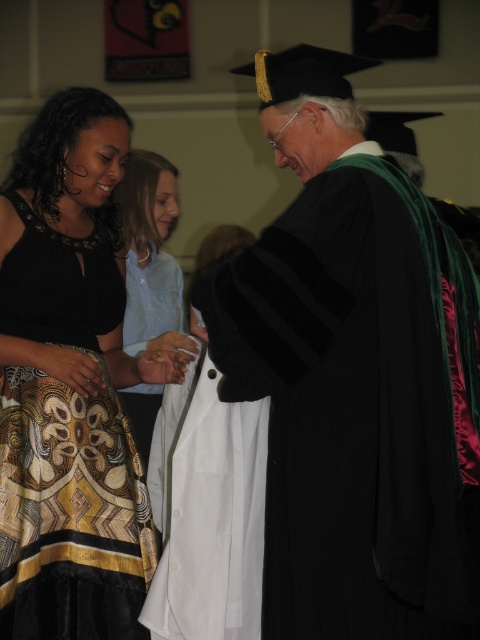
You are a photographer positioned at the back of the auditorium. You need to capture a photo that includes both the matte black graduation gown at center and the patterned fabric dress at lower left. Based on their sizes, which object should you ensure is closer to the camera to avoid it being too small in the frame?

The patterned fabric dress at lower left is smaller in width compared to the matte black graduation gown at center. To ensure it isn not too small in the frame, you should position the patterned fabric dress at lower left closer to the camera.

You are a photographer positioned at the camera. You want to capture a closeup shot of the patterned fabric dress at lower left. Given that you are currently 2.10 meters away, can you move closer to achieve the desired shot without exceeding the minimum safe distance of 1.5 meters?

The minimum safe distance is 1.5 meters, and you are currently 2.10 meters away from the patterned fabric dress at lower left. You can move closer by 0.6 meters to achieve the desired shot while staying within the safe distance range.

You are attending a graduation ceremony and want to take a photo of both the matte black graduation gown at center and the patterned fabric dress at lower left. Which one should you focus on first to ensure both are in the frame?

You should focus on the matte black graduation gown at center first since it is closer to the viewer than the patterned fabric dress at lower left, ensuring both are in the frame by adjusting the camera angle accordingly.